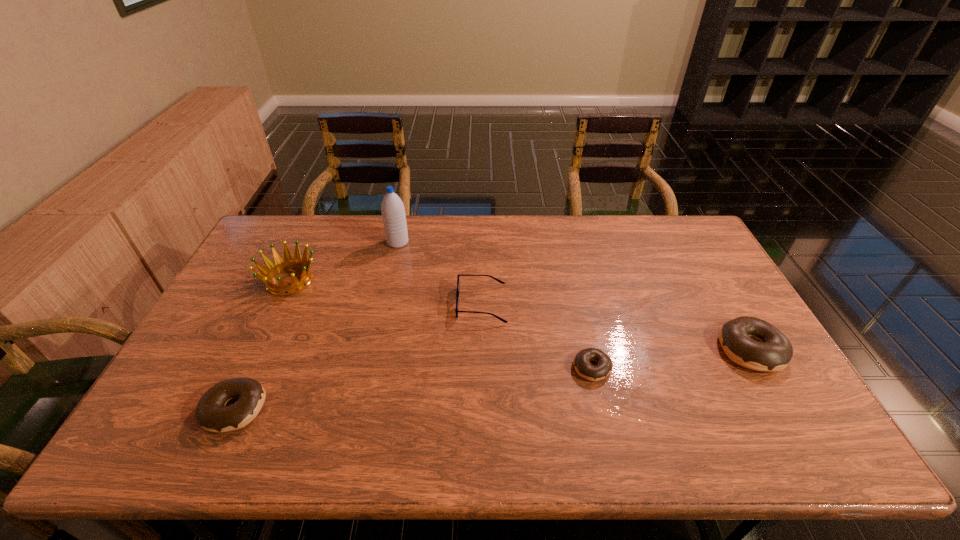
Identify the location of the leftmost doughnut. Image resolution: width=960 pixels, height=540 pixels. click(x=211, y=413).

You are a GUI agent. You are given a task and a screenshot of the screen. Output one action in this format:
    pyautogui.click(x=<x>, y=<y>)
    Task: Click on the fifth object from left to right
    The width and height of the screenshot is (960, 540).
    Given the screenshot: What is the action you would take?
    pyautogui.click(x=583, y=367)

Identify the location of the second doughnut from right to left. (583, 367).

At what (x,y) coordinates should I click in order to perform the action: click on the rightmost object. Please return your answer as a coordinate pair (x, y). Image resolution: width=960 pixels, height=540 pixels. Looking at the image, I should click on (772, 351).

Where is `water bottle`? The image size is (960, 540). water bottle is located at coordinates (393, 212).

You are a GUI agent. You are given a task and a screenshot of the screen. Output one action in this format:
    pyautogui.click(x=<x>, y=<y>)
    Task: Click on the farthest object
    The width and height of the screenshot is (960, 540).
    Given the screenshot: What is the action you would take?
    pyautogui.click(x=393, y=212)

Locate an element on the screen. the fifth shortest object is located at coordinates (272, 269).

You are a GUI agent. You are given a task and a screenshot of the screen. Output one action in this format:
    pyautogui.click(x=<x>, y=<y>)
    Task: Click on the spectacles
    The width and height of the screenshot is (960, 540).
    Given the screenshot: What is the action you would take?
    pyautogui.click(x=457, y=292)

I want to click on vacant space situated 0.170m on the right of the second shortest doughnut, so click(x=335, y=408).

In order to click on free space located 0.080m on the left of the shortest doughnut in this screenshot , I will do `click(542, 368)`.